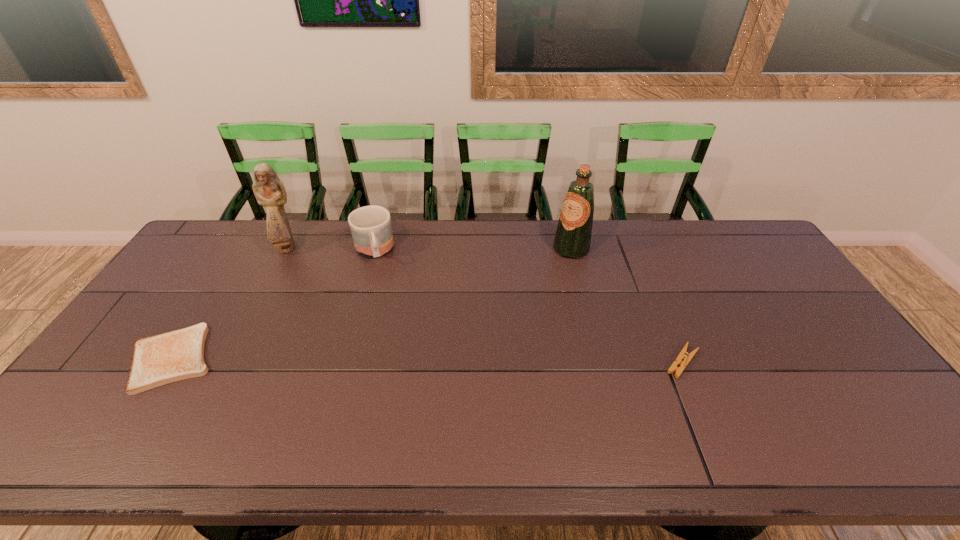
Locate an element on the screen. This screenshot has width=960, height=540. vacant region between the olive oil and the clothespin is located at coordinates (627, 305).

At what (x,y) coordinates should I click in order to perform the action: click on empty space that is in between the olive oil and the figurine. Please return your answer as a coordinate pair (x, y). This screenshot has height=540, width=960. Looking at the image, I should click on (429, 248).

Find the location of a particular element. The image size is (960, 540). empty space that is in between the figurine and the clothespin is located at coordinates (484, 305).

Find the location of `free space between the toast and the third object from right to left`. free space between the toast and the third object from right to left is located at coordinates (273, 305).

Image resolution: width=960 pixels, height=540 pixels. What are the coordinates of `free spot between the rightmost object and the second object from right to left` in the screenshot? It's located at (627, 305).

The image size is (960, 540). What are the coordinates of `free spot between the second object from right to left and the figurine` in the screenshot? It's located at (429, 248).

Where is `vacant point located between the figurine and the mug`? Image resolution: width=960 pixels, height=540 pixels. vacant point located between the figurine and the mug is located at coordinates (330, 249).

This screenshot has width=960, height=540. In order to click on object identified as the second closest to the clothespin in this screenshot , I will do `click(371, 229)`.

Choose which object is the nearest neighbor to the shortest object. Please provide its 2D coordinates. Your answer should be formatted as a tuple, i.e. [(x, y)], where the tuple contains the x and y coordinates of a point satisfying the conditions above.

[(268, 189)]

This screenshot has height=540, width=960. Find the location of `vacant space that satisfies the following two spatial constraints: 1. on the front side of the mug; 2. on the right side of the clothespin`. vacant space that satisfies the following two spatial constraints: 1. on the front side of the mug; 2. on the right side of the clothespin is located at coordinates (343, 362).